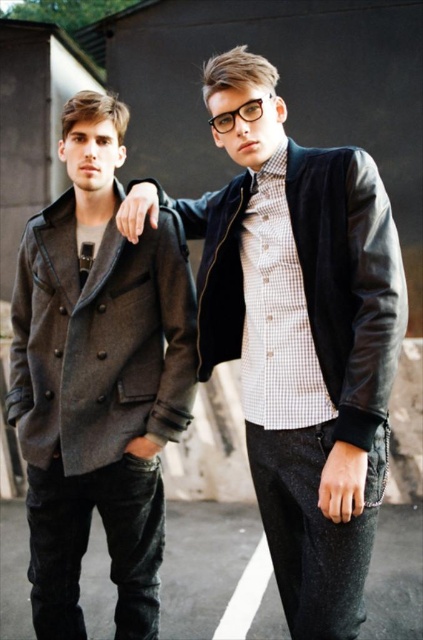
Is the position of leather jacket at center more distant than that of dark gray woolen jacket at left?

No, leather jacket at center is in front of dark gray woolen jacket at left.

Based on the photo, does leather jacket at center have a greater height compared to dark gray woolen jacket at left?

Correct, leather jacket at center is much taller as dark gray woolen jacket at left.

Is point (304, 556) behind point (109, 408)?

No, it is not.

The image size is (423, 640). I want to click on leather jacket at center, so click(x=301, y=336).